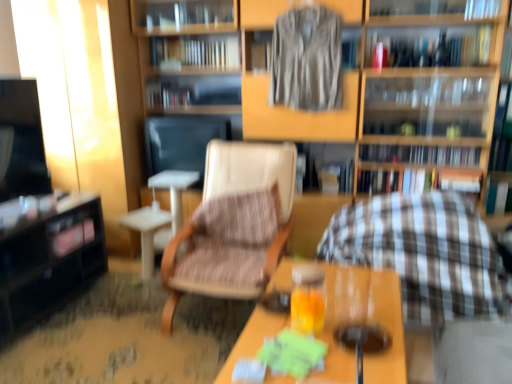
This screenshot has width=512, height=384. I want to click on free spot below translucent glass beverage at center (from a real-world perspective), so click(x=362, y=336).